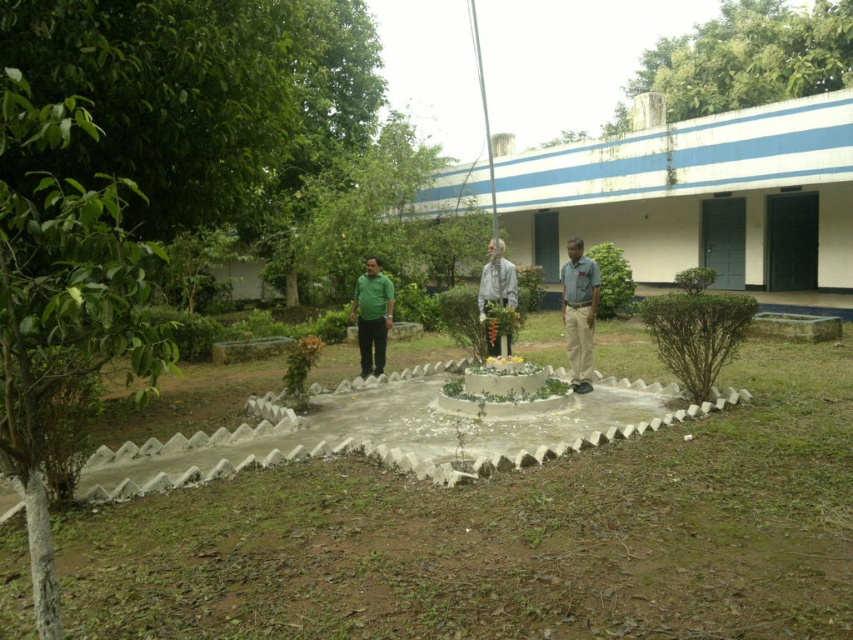
You are planning to place a new bench in the garden so that it can be seen from both the green leafy tree at upper center and the gray fabric statue at center. Based on their sizes, which object would make the bench more visible?

The green leafy tree at upper center is larger than the gray fabric statue at center, so placing the bench near the larger tree would make it more visible from both points since the tree provides a better vantage point.

You are standing at the point marked by the coordinates point (x=508, y=538). What is the nearest object to you in the scene?

The nearest object to you at point (x=508, y=538) is the concrete at center, as you are standing directly on it.

You are taking a photo of the garden scene. You want to focus on the point at coordinate point (61, 220) and point (498, 353). Which point should you adjust your camera focus to first to ensure it is in sharp focus?

You should focus on point (61, 220) first because it is closer to the camera than point (498, 353), so focusing on the closer point ensures the foreground is sharp before adjusting for the background.